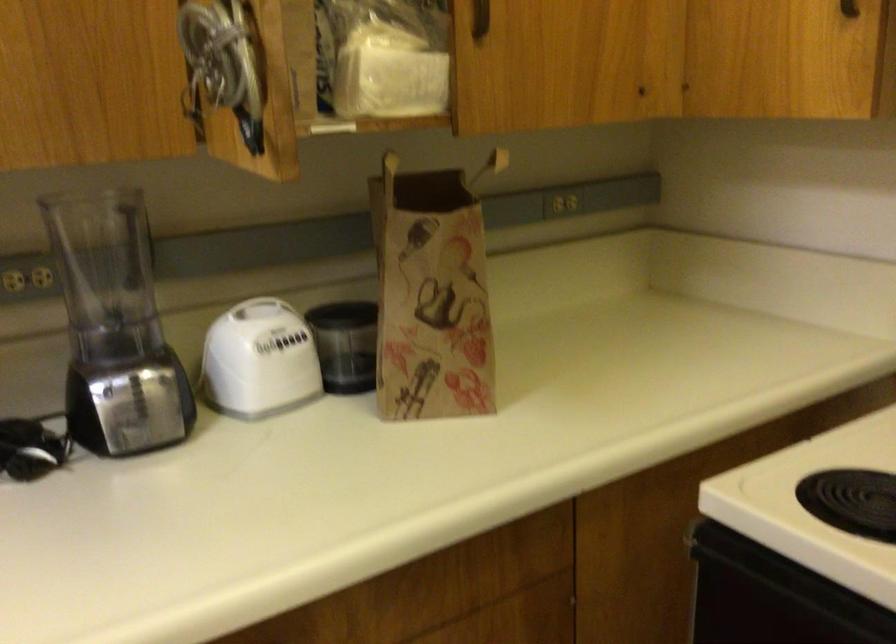
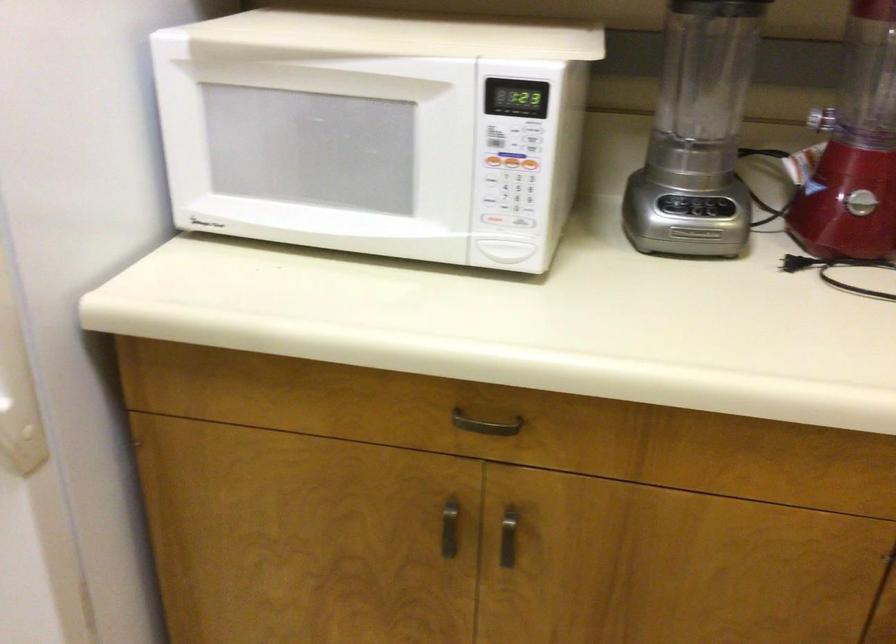
Based on the photo, the images are taken continuously from a first-person perspective. In which direction is your viewpoint rotating?

The rotation direction of the camera is left-down.